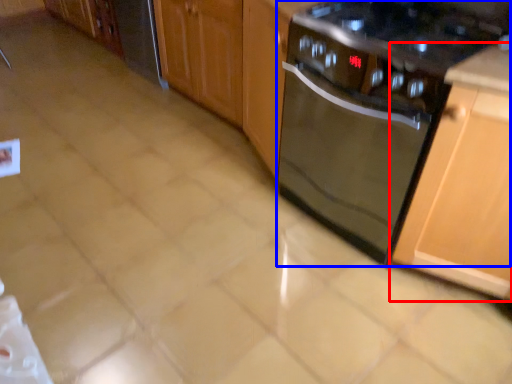
Question: Which object is further to the camera taking this photo, cabinetry (highlighted by a red box) or kitchen appliance (highlighted by a blue box)?

Choices:
 (A) cabinetry
 (B) kitchen appliance

Answer: (B)